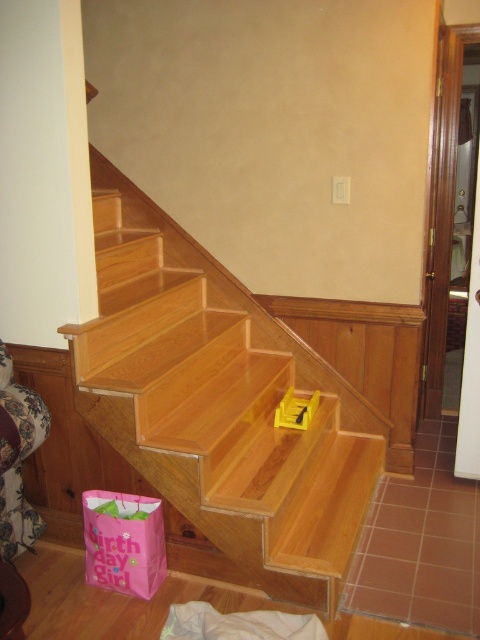
Question: Does natural wood stairs at center appear over yellow plastic toy at center?

Choices:
 (A) yes
 (B) no

Answer: (A)

Question: Does natural wood stairs at center appear over yellow plastic toy at center?

Choices:
 (A) no
 (B) yes

Answer: (B)

Question: Among these objects, which one is nearest to the camera?

Choices:
 (A) natural wood stairs at center
 (B) yellow plastic toy at center

Answer: (A)

Question: Which object appears farthest from the camera in this image?

Choices:
 (A) yellow plastic toy at center
 (B) natural wood stairs at center

Answer: (A)

Question: Is natural wood stairs at center smaller than yellow plastic toy at center?

Choices:
 (A) no
 (B) yes

Answer: (A)

Question: Which object is farther from the camera taking this photo?

Choices:
 (A) natural wood stairs at center
 (B) yellow plastic toy at center

Answer: (B)